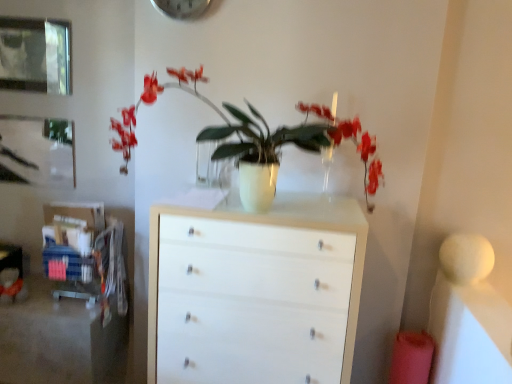
Question: Considering the relative positions of metallic silver clock at upper center and white glossy chest of drawers at center in the image provided, is metallic silver clock at upper center to the left or to the right of white glossy chest of drawers at center?

Choices:
 (A) left
 (B) right

Answer: (A)

Question: Considering their positions, is metallic silver clock at upper center located in front of or behind white glossy chest of drawers at center?

Choices:
 (A) front
 (B) behind

Answer: (B)

Question: Which object is the closest to the white glossy vase at center?

Choices:
 (A) white glossy chest of drawers at center
 (B) brushed metal picture frame at upper left, which ranks as the 1th picture frame in bottom-to-top order
 (C) metallic glass picture frame at upper left, the first picture frame viewed from the front
 (D) metallic silver clock at upper center

Answer: (A)

Question: Estimate the real-world distances between objects in this image. Which object is closer to the white glossy chest of drawers at center?

Choices:
 (A) metallic glass picture frame at upper left, the first picture frame viewed from the front
 (B) metallic silver clock at upper center
 (C) white glossy vase at center
 (D) brushed metal picture frame at upper left, which appears as the 2th picture frame when viewed from the top

Answer: (C)